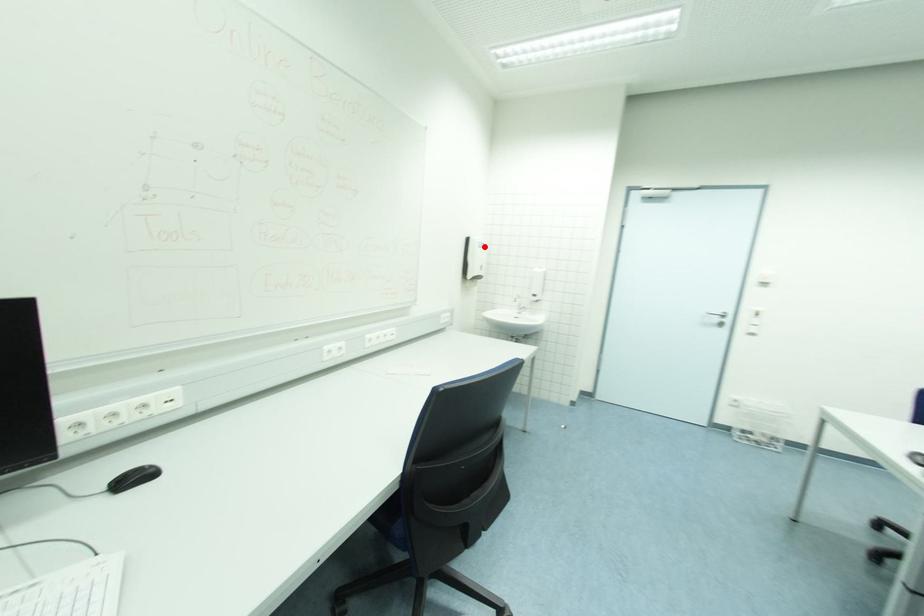
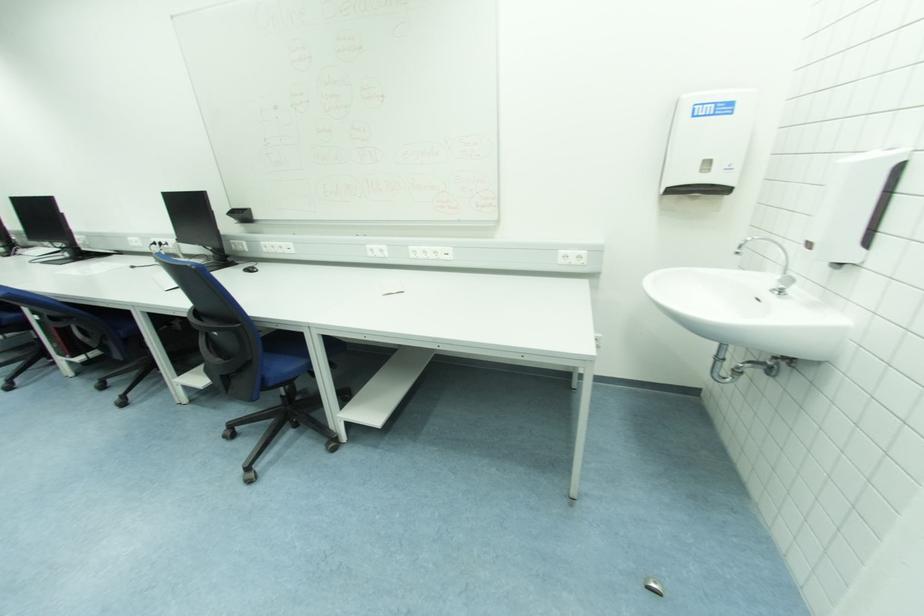
Question: A red point is marked in image1. In image2, is the corresponding 3D point closer to the camera or farther? Reply with the corresponding letter.

Choices:
 (A) The corresponding 3D point is closer.
 (B) The corresponding 3D point is farther.

Answer: (B)